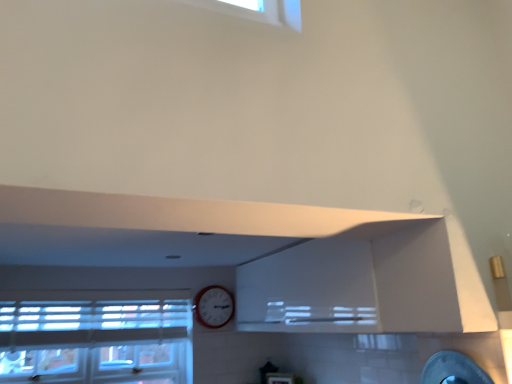
Describe the element at coordinates (214, 306) in the screenshot. I see `red glossy clock at center` at that location.

This screenshot has height=384, width=512. Identify the location of red glossy clock at center. (214, 306).

What is the approximate width of red glossy clock at center?

3.23 inches.

Where is `red glossy clock at center`? The height and width of the screenshot is (384, 512). red glossy clock at center is located at coordinates (214, 306).